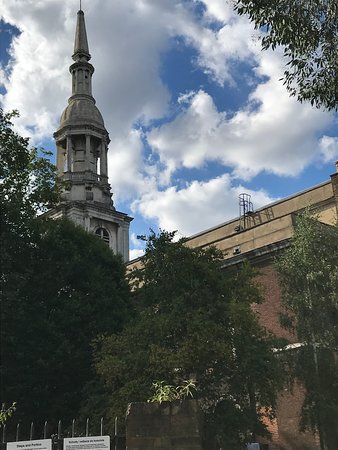
The image size is (338, 450). What are the coordinates of `ladder` in the screenshot? It's located at (246, 205).